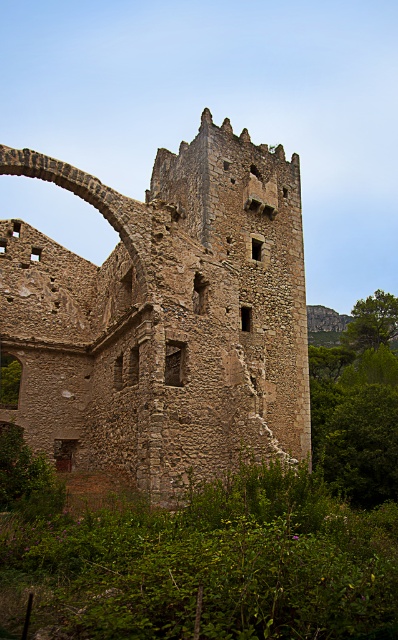
Question: Can you confirm if rustic stone tower at center is positioned to the right of green leafy vegetation at center?

Choices:
 (A) no
 (B) yes

Answer: (A)

Question: Which object appears farthest from the camera in this image?

Choices:
 (A) rustic stone tower at center
 (B) green leafy vegetation at center

Answer: (A)

Question: Which object appears closest to the camera in this image?

Choices:
 (A) rustic stone tower at center
 (B) green leafy vegetation at center

Answer: (B)

Question: Can you confirm if rustic stone tower at center is positioned below green leafy vegetation at center?

Choices:
 (A) yes
 (B) no

Answer: (B)

Question: Does rustic stone tower at center appear on the right side of green leafy vegetation at center?

Choices:
 (A) yes
 (B) no

Answer: (B)

Question: Which object appears closest to the camera in this image?

Choices:
 (A) rustic stone tower at center
 (B) green leafy vegetation at center

Answer: (B)